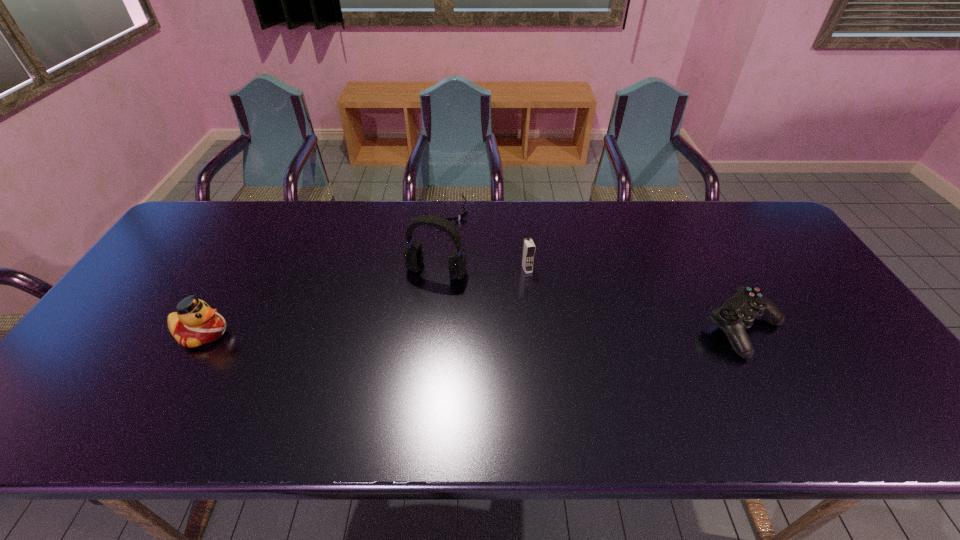
Find the location of a particular element. The width and height of the screenshot is (960, 540). free space located on the front-facing side of the shortest object is located at coordinates (504, 306).

Locate an element on the screen. The height and width of the screenshot is (540, 960). vacant space positioned on the front-facing side of the shortest object is located at coordinates (478, 265).

Identify the location of free space located 0.100m on the front-facing side of the shortest object. (463, 241).

Where is `vacant area located 0.340m on the headband of the headset`? Image resolution: width=960 pixels, height=540 pixels. vacant area located 0.340m on the headband of the headset is located at coordinates (376, 384).

The height and width of the screenshot is (540, 960). Find the location of `vacant space located 0.280m on the headband of the headset`. vacant space located 0.280m on the headband of the headset is located at coordinates (387, 363).

What are the coordinates of `blank area located 0.120m on the headband of the headset` in the screenshot? It's located at (411, 315).

The height and width of the screenshot is (540, 960). I want to click on vacant space located on the front-facing side of the second object from right to left, so click(572, 374).

Identify the location of free space located 0.170m on the front-facing side of the second object from right to left. The height and width of the screenshot is (540, 960). (547, 317).

Image resolution: width=960 pixels, height=540 pixels. Find the location of `free space located on the front-facing side of the second object from right to left`. free space located on the front-facing side of the second object from right to left is located at coordinates (547, 317).

Where is `object present at the far edge`? Image resolution: width=960 pixels, height=540 pixels. object present at the far edge is located at coordinates (459, 217).